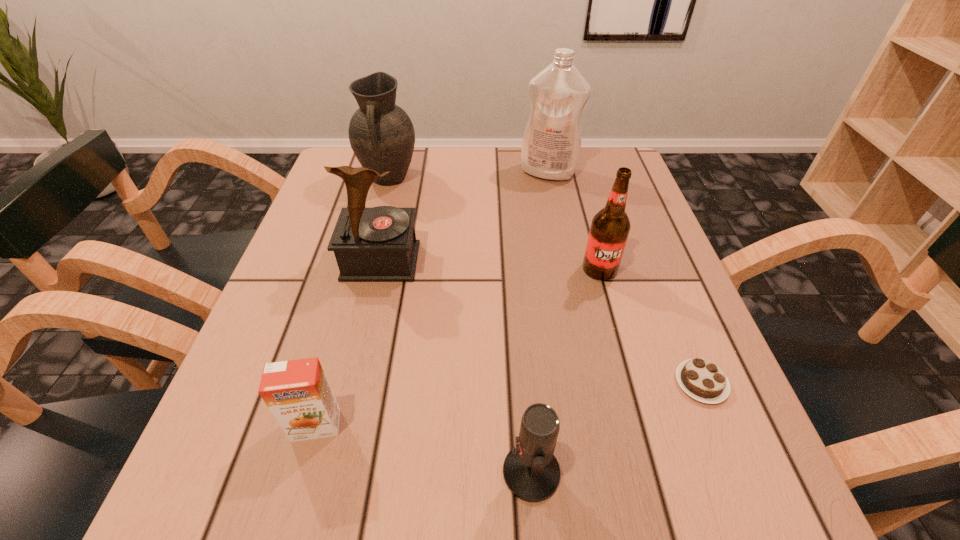
Locate an element on the screen. The width and height of the screenshot is (960, 540). pitcher present at the left edge is located at coordinates (381, 134).

Find the location of a particular element. phonograph_record at the left edge is located at coordinates (378, 244).

At what (x,y) coordinates should I click in order to perform the action: click on orange juice situated at the left edge. Please return your answer as a coordinate pair (x, y). Image resolution: width=960 pixels, height=540 pixels. Looking at the image, I should click on (297, 392).

Where is `detergent that is at the right edge`? detergent that is at the right edge is located at coordinates (551, 145).

What are the coordinates of `root beer that is at the right edge` in the screenshot? It's located at (610, 227).

At what (x,y) coordinates should I click in order to perform the action: click on chocolate cake located at the right edge. Please return your answer as a coordinate pair (x, y). This screenshot has height=540, width=960. Looking at the image, I should click on (701, 379).

Locate an element on the screen. object that is at the far left corner is located at coordinates (381, 134).

Locate an element on the screen. object situated at the far right corner is located at coordinates (551, 145).

The width and height of the screenshot is (960, 540). In the image, there is a desktop. In order to click on vacant region at the far edge in this screenshot , I will do `click(505, 177)`.

This screenshot has width=960, height=540. I want to click on vacant space at the near edge of the desktop, so click(353, 502).